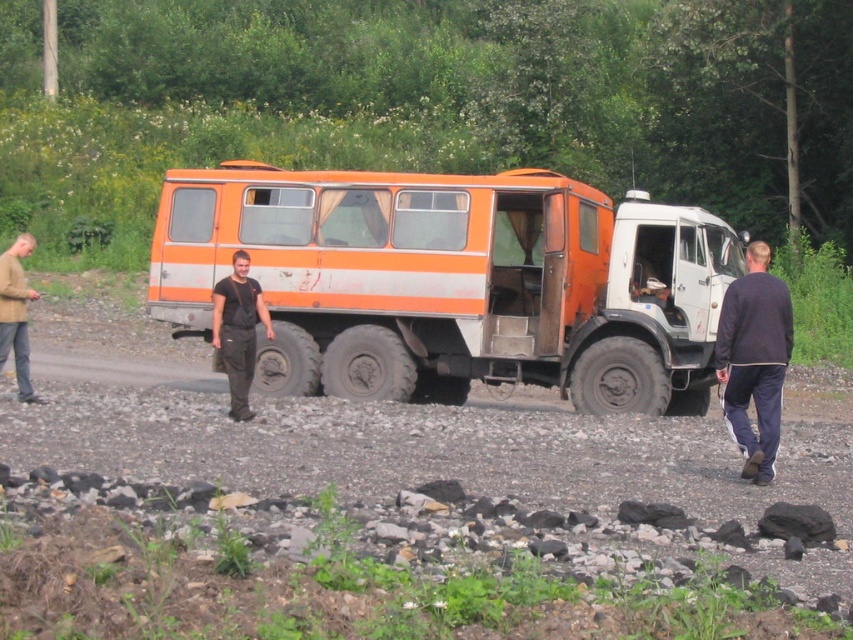
Question: Which object appears farthest from the camera in this image?

Choices:
 (A) light brown sweater at left
 (B) orange matte truck at center
 (C) gray gravel at lower center
 (D) dark gray fabric pants at center

Answer: (B)

Question: Which point is farther to the camera?

Choices:
 (A) dark blue sweatshirt at right
 (B) light brown sweater at left
 (C) dark gray fabric pants at center

Answer: (B)

Question: Where is orange matte truck at center located in relation to light brown sweater at left in the image?

Choices:
 (A) left
 (B) right

Answer: (B)

Question: Does orange matte truck at center have a greater width compared to light brown sweater at left?

Choices:
 (A) no
 (B) yes

Answer: (A)

Question: Which of these objects is positioned closest to the orange matte truck at center?

Choices:
 (A) dark blue sweatshirt at right
 (B) dark gray fabric pants at center
 (C) light brown sweater at left

Answer: (B)

Question: Is orange matte truck at center further to the viewer compared to gray gravel at lower center?

Choices:
 (A) yes
 (B) no

Answer: (A)